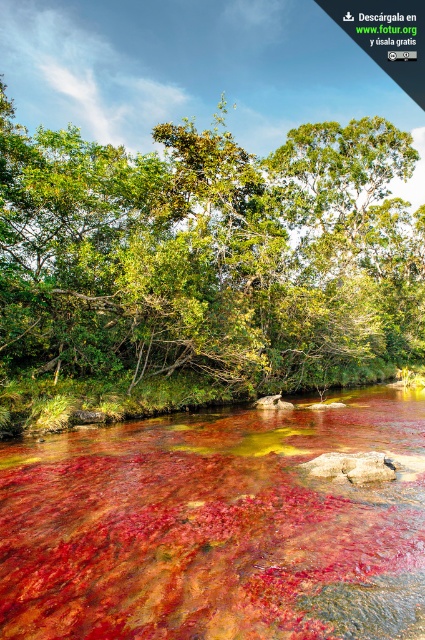
Is green leafy tree at center smaller than translucent red water at center?

No.

Can you confirm if green leafy tree at center is shorter than translucent red water at center?

Incorrect, green leafy tree at center's height does not fall short of translucent red water at center's.

Is point (180, 364) farther from viewer compared to point (373, 538)?

Yes.

Image resolution: width=425 pixels, height=640 pixels. I want to click on green leafy tree at center, so click(209, 256).